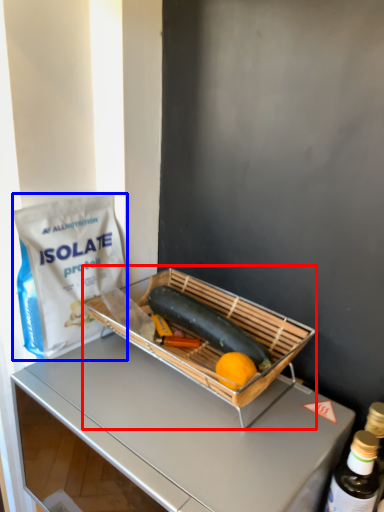
Question: Which point is closer to the camera, appliance (highlighted by a red box) or grocery bag (highlighted by a blue box)?

Choices:
 (A) appliance
 (B) grocery bag

Answer: (A)